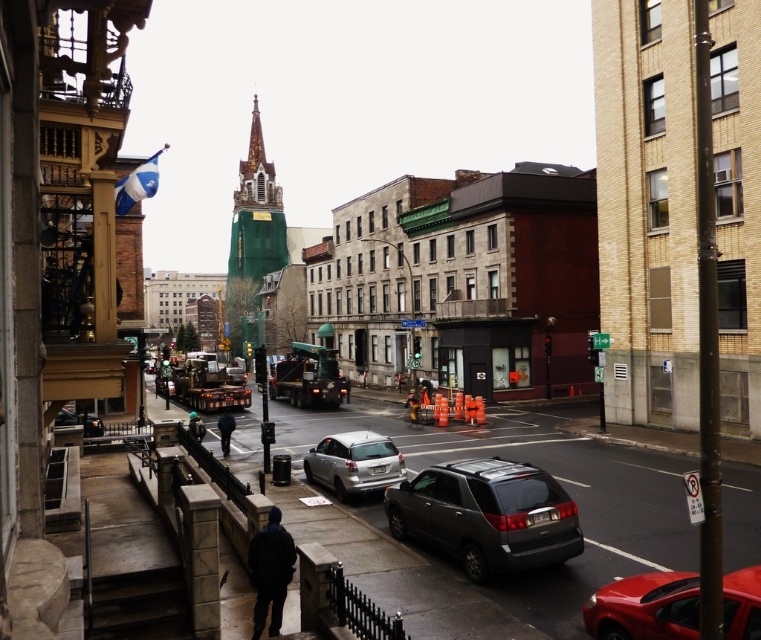
Which is below, satin silver car at center or dark blue fabric construction worker at lower center?

satin silver car at center is lower down.

Between satin silver car at center and dark blue fabric construction worker at lower center, which one appears on the left side from the viewer's perspective?

From the viewer's perspective, dark blue fabric construction worker at lower center appears more on the left side.

Which is behind, point (336, 452) or point (260, 576)?

The point (336, 452) is more distant.

Image resolution: width=761 pixels, height=640 pixels. I want to click on satin silver car at center, so click(354, 464).

Is shiny red car at lower right taller than matte black truck at center?

Incorrect, shiny red car at lower right's height is not larger of matte black truck at center's.

From the picture: Between shiny red car at lower right and matte black truck at center, which one has less height?

With less height is shiny red car at lower right.

Between point (752, 572) and point (231, 374), which one is positioned in front?

Point (752, 572)

I want to click on shiny red car at lower right, so click(645, 608).

Which is above, matte gray suv at center or matte black truck at center?

Positioned higher is matte black truck at center.

Is point (457, 497) behind point (233, 369)?

No, it is not.

Which is behind, point (412, 506) or point (228, 378)?

Point (228, 378)

Where is `matte gray suv at center`? matte gray suv at center is located at coordinates (486, 515).